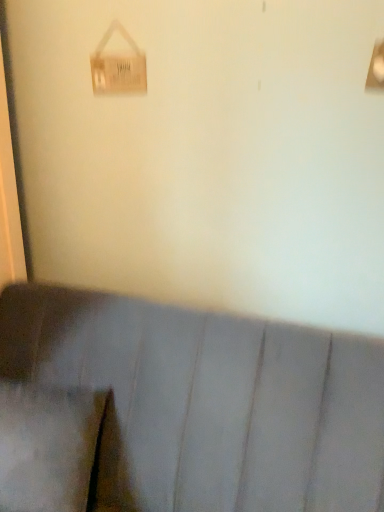
Question: Is suede-like gray pillow at lower left directly adjacent to suede-like gray couch at lower center?

Choices:
 (A) no
 (B) yes

Answer: (A)

Question: Does suede-like gray pillow at lower left have a larger size compared to suede-like gray couch at lower center?

Choices:
 (A) no
 (B) yes

Answer: (A)

Question: Does suede-like gray pillow at lower left have a smaller size compared to suede-like gray couch at lower center?

Choices:
 (A) no
 (B) yes

Answer: (B)

Question: Could you tell me if suede-like gray pillow at lower left is turned towards suede-like gray couch at lower center?

Choices:
 (A) no
 (B) yes

Answer: (B)

Question: Can you confirm if suede-like gray pillow at lower left is thinner than suede-like gray couch at lower center?

Choices:
 (A) no
 (B) yes

Answer: (B)

Question: Is suede-like gray couch at lower center at the back of suede-like gray pillow at lower left?

Choices:
 (A) no
 (B) yes

Answer: (B)

Question: Would you say suede-like gray pillow at lower left contains wooden sign at upper left?

Choices:
 (A) yes
 (B) no

Answer: (B)

Question: Is suede-like gray pillow at lower left outside of wooden sign at upper left?

Choices:
 (A) yes
 (B) no

Answer: (A)

Question: Can you confirm if suede-like gray pillow at lower left is bigger than wooden sign at upper left?

Choices:
 (A) yes
 (B) no

Answer: (A)

Question: Is the depth of suede-like gray pillow at lower left less than that of wooden sign at upper left?

Choices:
 (A) yes
 (B) no

Answer: (A)

Question: From a real-world perspective, is suede-like gray pillow at lower left positioned under wooden sign at upper left based on gravity?

Choices:
 (A) no
 (B) yes

Answer: (B)

Question: From the image's perspective, is suede-like gray pillow at lower left below wooden sign at upper left?

Choices:
 (A) no
 (B) yes

Answer: (B)

Question: Is the depth of suede-like gray couch at lower center less than that of suede-like gray pillow at lower left?

Choices:
 (A) no
 (B) yes

Answer: (B)